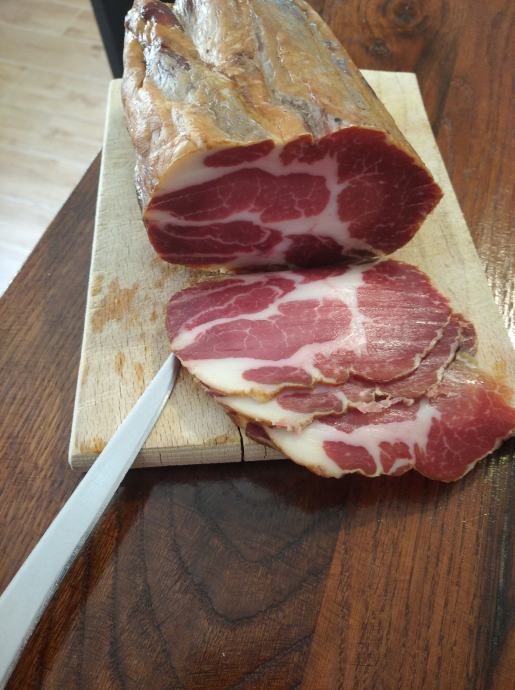
The width and height of the screenshot is (515, 690). In order to click on chair back in this screenshot , I will do `click(113, 12)`.